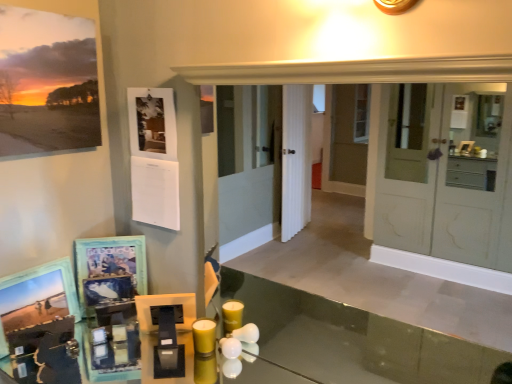
Measure the distance between point [72,312] and camera.

Point [72,312] and camera are 1.48 meters apart from each other.

Find the location of `wooden photo frame at lower left, the first picture frame ordered from the bottom`. wooden photo frame at lower left, the first picture frame ordered from the bottom is located at coordinates (49, 272).

From the image's perspective, is wooden photo frame at lower left, which is counted as the third picture frame, starting from the top, on top of wooden picture frame at lower left, which is counted as the 2th picture frame, starting from the bottom?

No.

From the wooden picture frame at lower left, which is counted as the 2th picture frame, starting from the bottom, count 1st picture frames forward and point to it. Please provide its 2D coordinates.

[(49, 272)]

Does point (39, 272) appear closer or farther from the camera than point (83, 307)?

Point (39, 272) is positioned closer to the camera compared to point (83, 307).

Looking at this image, considering the relative positions of wooden photo frame at lower left, the first picture frame ordered from the bottom, and wooden picture frame at lower left, which is counted as the 2th picture frame, starting from the bottom, in the image provided, is wooden photo frame at lower left, the first picture frame ordered from the bottom, to the left of wooden picture frame at lower left, which is counted as the 2th picture frame, starting from the bottom, from the viewer's perspective?

Yes.

Considering the relative positions of wooden picture frame at lower left, which is counted as the 2th picture frame, starting from the bottom, and wooden photo frame at lower left, the first picture frame ordered from the bottom, in the image provided, is wooden picture frame at lower left, which is counted as the 2th picture frame, starting from the bottom, to the left of wooden photo frame at lower left, the first picture frame ordered from the bottom, from the viewer's perspective?

No, wooden picture frame at lower left, which is counted as the 2th picture frame, starting from the bottom, is not to the left of wooden photo frame at lower left, the first picture frame ordered from the bottom.

From a real-world perspective, is wooden picture frame at lower left, which is counted as the 2th picture frame, starting from the bottom, positioned above or below wooden photo frame at lower left, which is counted as the third picture frame, starting from the top?

From a real-world perspective, wooden picture frame at lower left, which is counted as the 2th picture frame, starting from the bottom, is physically above wooden photo frame at lower left, which is counted as the third picture frame, starting from the top.

Between wooden picture frame at lower left, which is counted as the 2th picture frame, starting from the bottom, and wooden photo frame at lower left, the first picture frame ordered from the bottom, which one has larger width?

With larger width is wooden photo frame at lower left, the first picture frame ordered from the bottom.

In order to click on the 2nd picture frame to the left of the yellow matte candle at lower center, starting your count from the anchor in this screenshot , I will do click(44, 80).

Can you tell me how much matte paper print at upper left, the 1th picture frame positioned from the top, and yellow matte candle at lower center differ in facing direction?

They differ by 89.6 degrees in their facing directions.

In terms of height, does matte paper print at upper left, the 3th picture frame when ordered from bottom to top, look taller or shorter compared to yellow matte candle at lower center?

Considering their sizes, matte paper print at upper left, the 3th picture frame when ordered from bottom to top, has more height than yellow matte candle at lower center.

From the image's perspective, is matte paper print at upper left, the 3th picture frame when ordered from bottom to top, beneath yellow matte candle at lower center?

Incorrect, from the image's perspective, matte paper print at upper left, the 3th picture frame when ordered from bottom to top, is higher than yellow matte candle at lower center.

Are yellow matte candle at lower center and wooden photo frame at lower left, the first picture frame ordered from the bottom, beside each other?

No, yellow matte candle at lower center is not with wooden photo frame at lower left, the first picture frame ordered from the bottom.

Could wooden photo frame at lower left, the first picture frame ordered from the bottom, be considered to be inside yellow matte candle at lower center?

No, wooden photo frame at lower left, the first picture frame ordered from the bottom, is not a part of yellow matte candle at lower center.

Between matte paper print at upper left, the 1th picture frame positioned from the top, and wooden photo frame at lower left, the first picture frame ordered from the bottom, which one is positioned in front?

matte paper print at upper left, the 1th picture frame positioned from the top, is closer to the camera.

How distant is matte paper print at upper left, the 1th picture frame positioned from the top, from wooden photo frame at lower left, which is counted as the third picture frame, starting from the top?

A distance of 22.05 inches exists between matte paper print at upper left, the 1th picture frame positioned from the top, and wooden photo frame at lower left, which is counted as the third picture frame, starting from the top.

Which point is more forward, (84, 81) or (53, 261)?

The point (84, 81) is in front.

From the image's perspective, relative to wooden photo frame at lower left, the first picture frame ordered from the bottom, is matte paper print at upper left, the 3th picture frame when ordered from bottom to top, above or below?

Based on their image positions, matte paper print at upper left, the 3th picture frame when ordered from bottom to top, is located above wooden photo frame at lower left, the first picture frame ordered from the bottom.

Identify the location of the 2nd picture frame directly above the yellow matte candle at lower center (from a real-world perspective). (110, 264).

Looking at this image, could you tell me if yellow matte candle at lower center is turned towards wooden picture frame at lower left, which is counted as the 2th picture frame, starting from the bottom?

No, yellow matte candle at lower center is not turned towards wooden picture frame at lower left, which is counted as the 2th picture frame, starting from the bottom.

Consider the image. Between yellow matte candle at lower center and wooden picture frame at lower left, which appears as the 2th picture frame when viewed from the top, which one is positioned in front?

Positioned in front is yellow matte candle at lower center.

Does yellow matte candle at lower center have a smaller size compared to wooden picture frame at lower left, which is counted as the 2th picture frame, starting from the bottom?

Yes, yellow matte candle at lower center is smaller than wooden picture frame at lower left, which is counted as the 2th picture frame, starting from the bottom.

Is yellow matte candle at lower center inside wooden photo frame at lower left, the first picture frame ordered from the bottom?

That's incorrect, yellow matte candle at lower center is not inside wooden photo frame at lower left, the first picture frame ordered from the bottom.

Which is farther, (74, 289) or (195, 347)?

The point (74, 289) is farther from the camera.

From the image's perspective, is wooden photo frame at lower left, which is counted as the third picture frame, starting from the top, below yellow matte candle at lower center?

Actually, wooden photo frame at lower left, which is counted as the third picture frame, starting from the top, appears above yellow matte candle at lower center in the image.

In order to click on candle on the right side of wooden photo frame at lower left, the first picture frame ordered from the bottom in this screenshot , I will do click(204, 336).

Identify the location of the 2nd picture frame counting from the right side of the wooden photo frame at lower left, the first picture frame ordered from the bottom. Image resolution: width=512 pixels, height=384 pixels. (110, 264).

Where is `the 2nd picture frame to the left when counting from the wooden picture frame at lower left, which is counted as the 2th picture frame, starting from the bottom`? the 2nd picture frame to the left when counting from the wooden picture frame at lower left, which is counted as the 2th picture frame, starting from the bottom is located at coordinates (49, 272).

Considering their positions, is yellow matte candle at lower center positioned further to wooden photo frame at lower left, the first picture frame ordered from the bottom, than wooden picture frame at lower left, which appears as the 2th picture frame when viewed from the top?

The object further to wooden photo frame at lower left, the first picture frame ordered from the bottom, is yellow matte candle at lower center.

Looking at the image, which one is located further to yellow matte candle at lower center, wooden photo frame at lower left, which is counted as the third picture frame, starting from the top, or wooden picture frame at lower left, which appears as the 2th picture frame when viewed from the top?

wooden photo frame at lower left, which is counted as the third picture frame, starting from the top, lies further to yellow matte candle at lower center than the other object.

When comparing their distances from yellow matte candle at lower center, does wooden picture frame at lower left, which appears as the 2th picture frame when viewed from the top, or wooden photo frame at lower left, which is counted as the third picture frame, starting from the top, seem closer?

wooden picture frame at lower left, which appears as the 2th picture frame when viewed from the top, is positioned closer to the anchor yellow matte candle at lower center.

From the picture: When comparing their distances from matte paper print at upper left, the 1th picture frame positioned from the top, does yellow matte candle at lower center or wooden picture frame at lower left, which appears as the 2th picture frame when viewed from the top, seem closer?

wooden picture frame at lower left, which appears as the 2th picture frame when viewed from the top, is closer to matte paper print at upper left, the 1th picture frame positioned from the top.

Consider the image. Based on their spatial positions, is wooden picture frame at lower left, which is counted as the 2th picture frame, starting from the bottom, or yellow matte candle at lower center closer to wooden photo frame at lower left, the first picture frame ordered from the bottom?

Based on the image, wooden picture frame at lower left, which is counted as the 2th picture frame, starting from the bottom, appears to be nearer to wooden photo frame at lower left, the first picture frame ordered from the bottom.

Considering their positions, is matte paper print at upper left, the 1th picture frame positioned from the top, positioned further to wooden photo frame at lower left, which is counted as the third picture frame, starting from the top, than yellow matte candle at lower center?

matte paper print at upper left, the 1th picture frame positioned from the top, lies further to wooden photo frame at lower left, which is counted as the third picture frame, starting from the top, than the other object.

Estimate the real-world distances between objects in this image. Which object is closer to wooden picture frame at lower left, which is counted as the 2th picture frame, starting from the bottom, matte paper print at upper left, the 3th picture frame when ordered from bottom to top, or yellow matte candle at lower center?

The object closer to wooden picture frame at lower left, which is counted as the 2th picture frame, starting from the bottom, is yellow matte candle at lower center.

Based on the photo, from the image, which object appears to be farther from yellow matte candle at lower center, wooden picture frame at lower left, which is counted as the 2th picture frame, starting from the bottom, or matte paper print at upper left, the 1th picture frame positioned from the top?

matte paper print at upper left, the 1th picture frame positioned from the top.

The image size is (512, 384). I want to click on picture frame between matte paper print at upper left, the 3th picture frame when ordered from bottom to top, and wooden photo frame at lower left, the first picture frame ordered from the bottom, in the up-down direction, so click(110, 264).